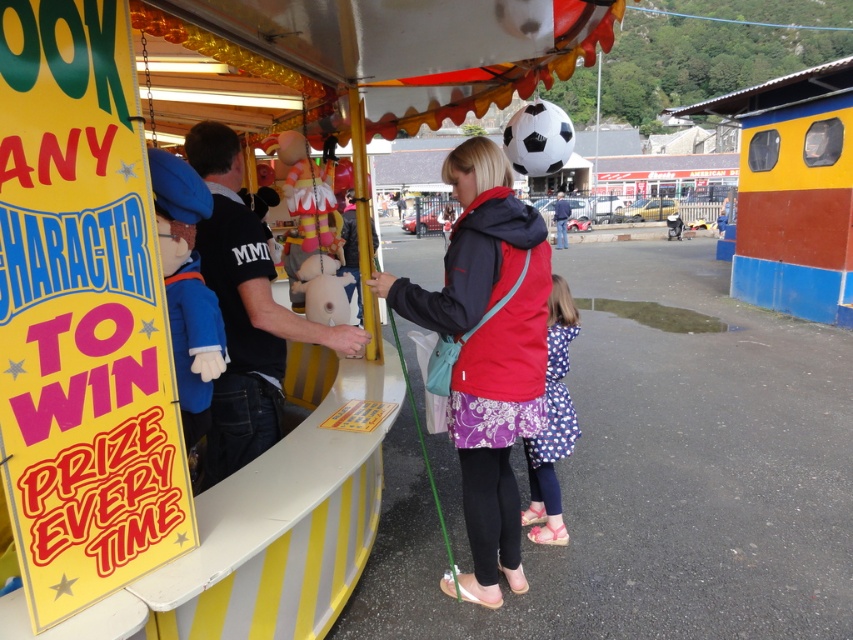
You are a customer at the fairground booth and want to choose between the polka dot fabric dress at lower center and the blue denim jacket at center. Which item is located to the left of the other?

The polka dot fabric dress at lower center is positioned on the left side of blue denim jacket at center.

You are a fashion designer observing the fairground scene and want to create a new outfit combining elements from the polka dot fabric dress at lower center and the blue denim jacket at center. Which item should you place on top to ensure the outfit layers correctly?

The blue denim jacket at center should be placed on top of the polka dot fabric dress at lower center because the polka dot fabric dress at lower center is positioned under the blue denim jacket at center in the image.

You are a photographer standing at the fairground. You want to take a photo of the black matte shirt at center without any obstructions. What is the minimum distance you need to move forward to ensure the shirt is in focus?

The black matte shirt at center is 2.13 meters away from the camera. To ensure it is in focus, you should move forward until the shirt is within the camera lens focus range, typically around 0.5 to 1 meter. Therefore, you need to move forward approximately 1.13 to 1.63 meters closer to the shirt.